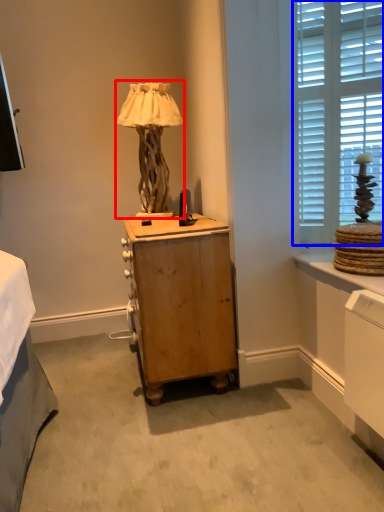
Question: Which point is further to the camera, table lamp (highlighted by a red box) or window (highlighted by a blue box)?

Choices:
 (A) table lamp
 (B) window

Answer: (A)